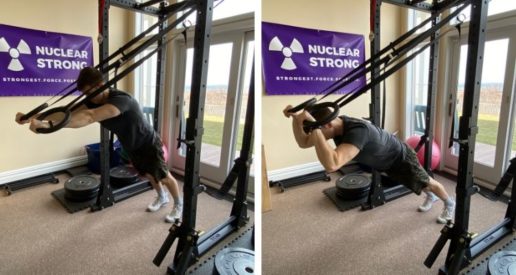
Find the location of `floor`. floor is located at coordinates (386, 248).